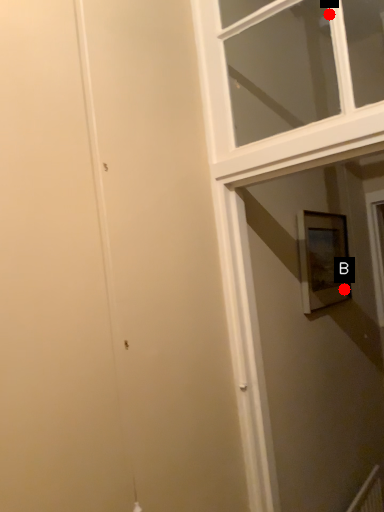
Question: Two points are circled on the image, labeled by A and B beside each circle. Among these points, which one is farthest from the camera?

Choices:
 (A) A is further
 (B) B is further

Answer: (B)